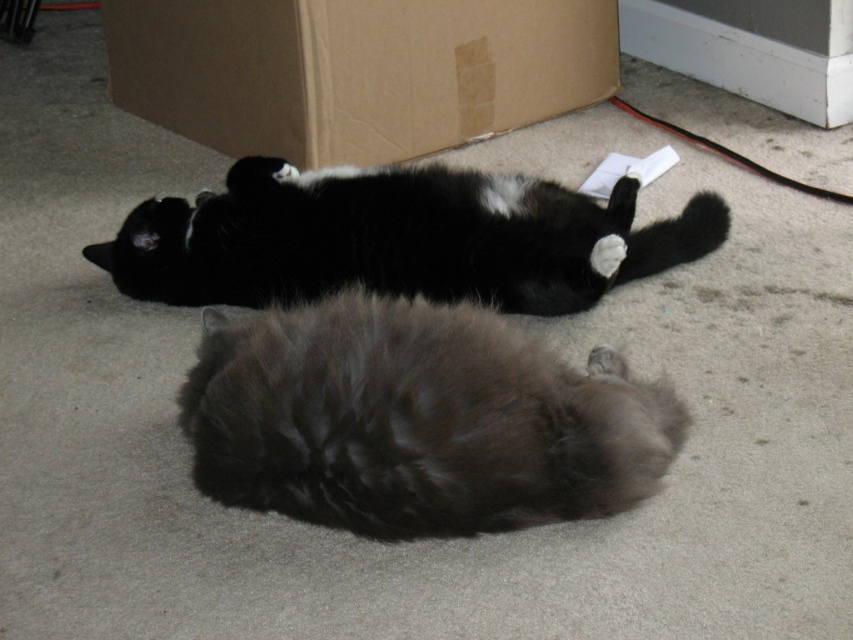
You are a cat owner who wants to ensure your cats are safe. You see the black fur cat at upper center and the white glossy baseboard at upper right. Which object is positioned lower in the image?

The black fur cat at upper center is positioned below the white glossy baseboard at upper right, so it is lower in the image.

You are standing at the origin point in the image. Which of the two points, point A at coordinates point A is point (421,509) and point B is point (271,44), is closer to you?

Point A at coordinates point A is point (421,509) is closer to you because it is in front of point B at point B is point (271,44).

You are a cat owner trying to locate your two cats in the living room. You see two points marked on the floor at coordinates point (x=654, y=227) and point (x=697, y=54). Which point is closer to you as you stand at the entrance of the living room?

Point (x=654, y=227) is in front of point (x=697, y=54), so the point closer to you is point (x=654, y=227).